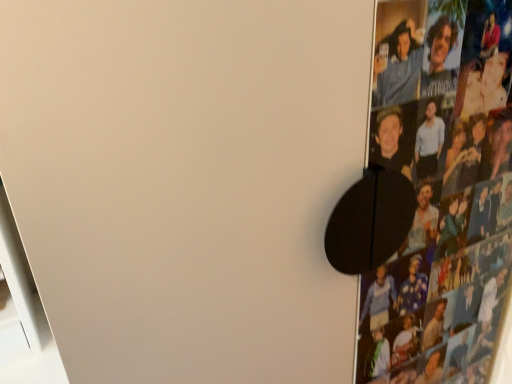
The image size is (512, 384). Identify the location of matte black poster at right. (443, 199).

The image size is (512, 384). What do you see at coordinates (443, 199) in the screenshot?
I see `matte black poster at right` at bounding box center [443, 199].

Image resolution: width=512 pixels, height=384 pixels. Find the location of `matte black poster at right`. matte black poster at right is located at coordinates (443, 199).